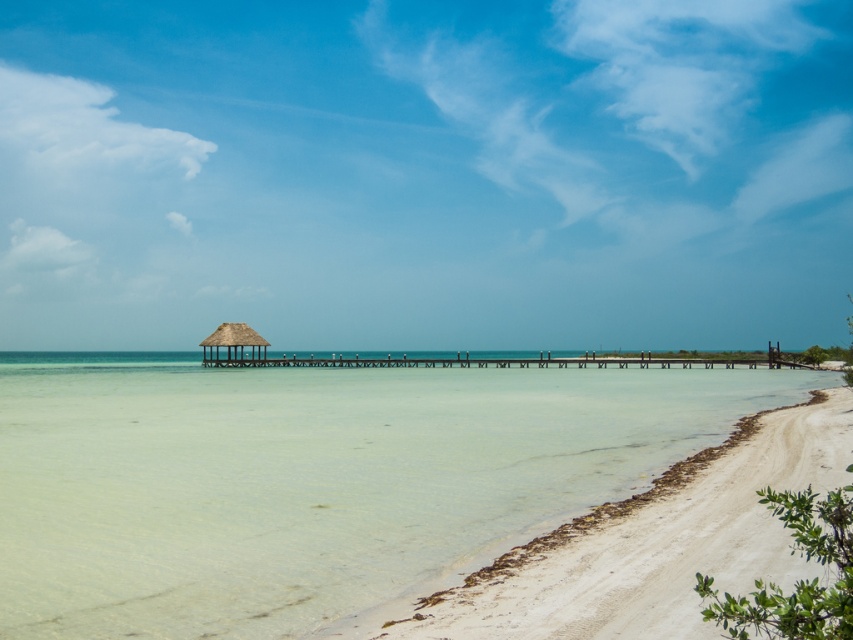
Question: Which object is farther from the camera taking this photo?

Choices:
 (A) thatched straw hut at center
 (B) white sand beach at center

Answer: (A)

Question: Can you confirm if white sand beach at center is positioned to the right of thatched straw hut at center?

Choices:
 (A) yes
 (B) no

Answer: (A)

Question: Which point is farther to the camera?

Choices:
 (A) white sand beach at center
 (B) thatched straw hut at center

Answer: (B)

Question: Is white sand beach at center thinner than thatched straw hut at center?

Choices:
 (A) no
 (B) yes

Answer: (A)

Question: From the image, what is the correct spatial relationship of white sand beach at center in relation to thatched straw hut at center?

Choices:
 (A) above
 (B) below

Answer: (B)

Question: Which object appears closest to the camera in this image?

Choices:
 (A) thatched straw hut at center
 (B) white sand beach at center

Answer: (B)